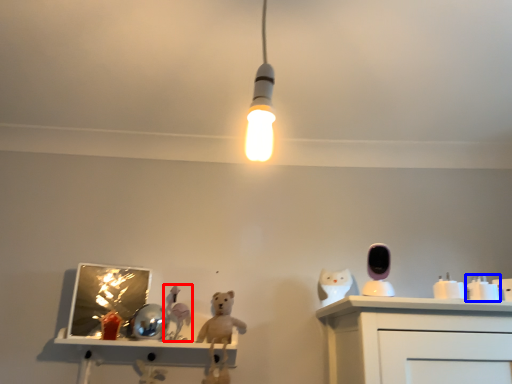
Question: Which of the following is the farthest to the observer, toy (highlighted by a red box) or toy (highlighted by a blue box)?

Choices:
 (A) toy
 (B) toy

Answer: (A)